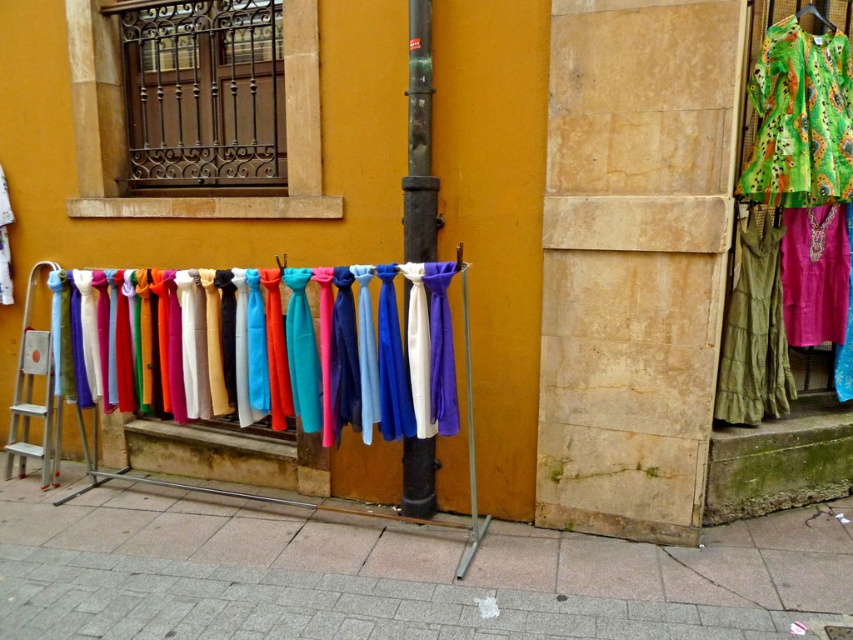
You are a customer at the scarf display. You want to pick up the vibrant pink fabric at center but need to avoid touching the metallic pole at center. Can you reach the fabric without moving the pole?

The metallic pole at center is closer to the viewer than the vibrant pink fabric at center, so you can reach the vibrant pink fabric at center without moving the pole because it is farther away.

You are standing at the origin point of the image. You want to move towards the point at coordinates point (x=109, y=282). However, there is an obstacle at point (x=788, y=188). Will you encounter the obstacle before reaching your destination?

Point (x=109, y=282) is behind point (x=788, y=188), so you will encounter the obstacle at point (x=788, y=188) before reaching your destination.